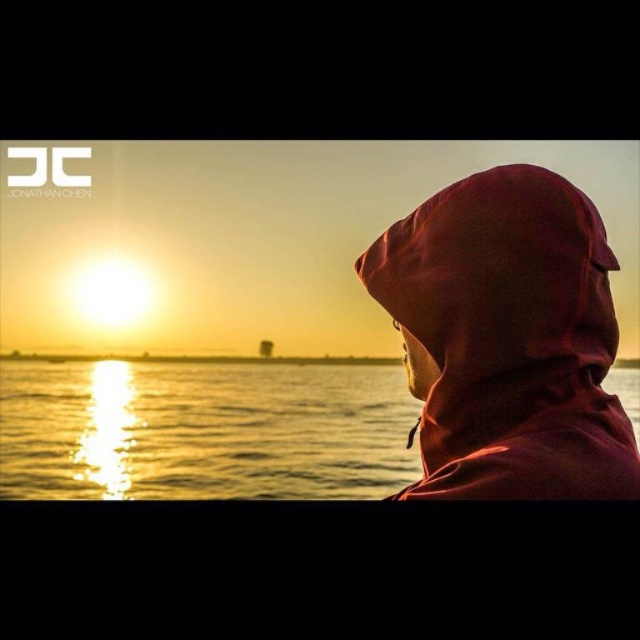
Question: Which point appears farthest from the camera in this image?

Choices:
 (A) (488, 356)
 (B) (376, 387)

Answer: (B)

Question: Does matte red hoodie at upper right appear on the left side of shiny metallic water at center?

Choices:
 (A) no
 (B) yes

Answer: (B)

Question: Can you confirm if matte red hoodie at upper right is positioned above shiny metallic water at center?

Choices:
 (A) no
 (B) yes

Answer: (B)

Question: Among these points, which one is farthest from the camera?

Choices:
 (A) (493, 241)
 (B) (112, 442)

Answer: (B)

Question: Can you confirm if matte red hoodie at upper right is bigger than shiny metallic water at center?

Choices:
 (A) yes
 (B) no

Answer: (B)

Question: Which point appears closest to the camera in this image?

Choices:
 (A) pos(12,497)
 (B) pos(445,353)

Answer: (B)